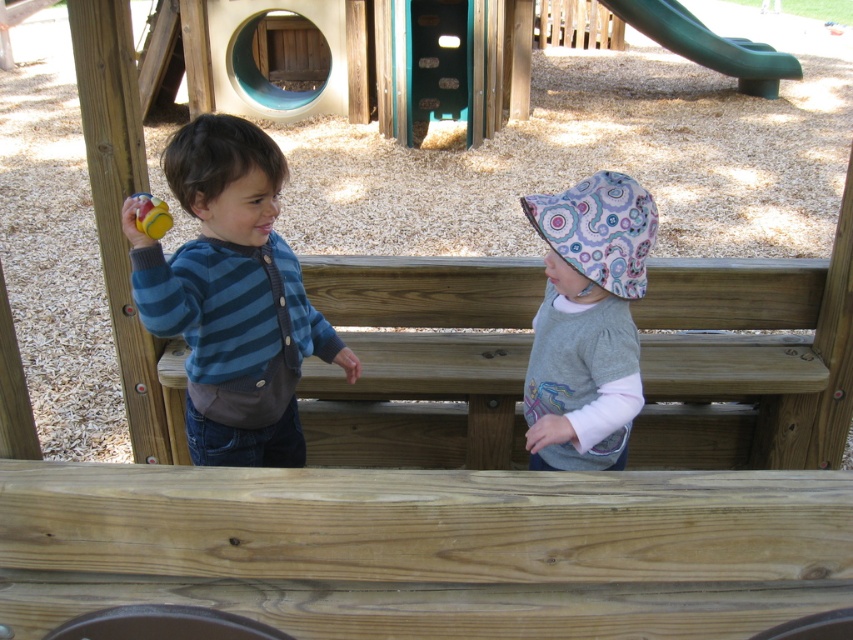
Question: Which point is farther to the camera?

Choices:
 (A) patterned fabric hat at center
 (B) green plastic slide at upper right
 (C) blue striped sweater at left

Answer: (B)

Question: Can you confirm if blue striped sweater at left is positioned to the left of patterned fabric hat at center?

Choices:
 (A) no
 (B) yes

Answer: (B)

Question: Does patterned fabric hat at center have a larger size compared to yellow rubber ball at left?

Choices:
 (A) no
 (B) yes

Answer: (B)

Question: Which point is farther to the camera?

Choices:
 (A) (263, 390)
 (B) (144, 216)
 (C) (708, 42)
 (D) (590, 369)

Answer: (C)

Question: Which of the following is the farthest from the observer?

Choices:
 (A) (213, 358)
 (B) (154, 236)

Answer: (A)

Question: Can you confirm if patterned fabric hat at center is positioned to the right of green plastic slide at upper right?

Choices:
 (A) yes
 (B) no

Answer: (B)